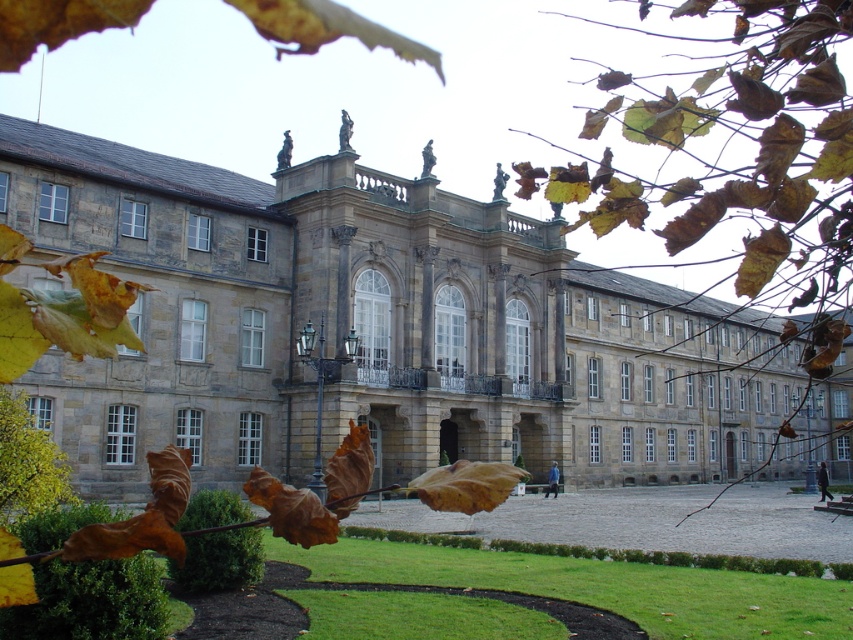
Which is more to the left, stone gray building at center or brown leafy branch at upper center?

stone gray building at center

Does stone gray building at center appear under brown leafy branch at upper center?

Correct, stone gray building at center is located below brown leafy branch at upper center.

Measure the distance between stone gray building at center and camera.

stone gray building at center is 61.42 meters from camera.

Find the location of a particular element. stone gray building at center is located at coordinates (378, 330).